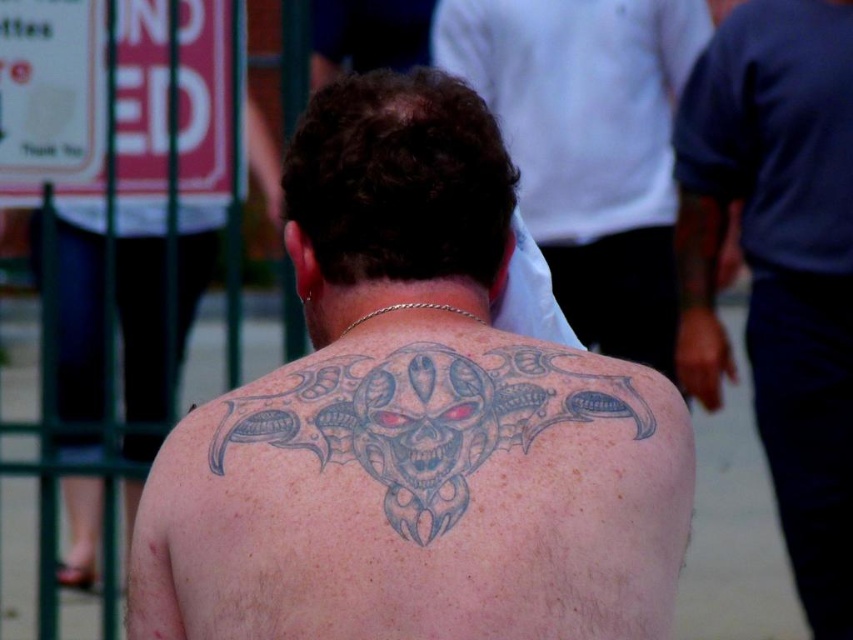
You are standing in a crowded park and see a person with a tattoo on their back. You want to take a photo of the tattoo without getting too close. The tattoo is located at point (370, 148). If your camera has a zoom lens that can focus on objects up to 2.5 meters away, can you capture the tattoo clearly from your current position?

The point (370, 148) is 2.30 meters away from the camera. Since the camera can focus up to 2.5 meters, you can capture the tattoo clearly from your current position because the distance is within the camera lens range.

You are a photographer trying to capture the tattoo on the gray tattooed skin at center and the dark blue shirt at right. Since you want to focus on the tattoo, which object should you zoom in on more and why?

You should zoom in more on the gray tattooed skin at center because its width surpasses that of the dark blue shirt at right, making it larger and easier to focus on the intricate details of the tattoo.

You are a photographer standing at a distance. You want to take a closeup photo of the gray tattooed skin at center. Your camera has a minimum focusing distance of 1.5 meters. Can you take the photo without moving closer?

The gray tattooed skin at center and viewer are 1.87 meters apart. Since the minimum focusing distance is 1.5 meters, you can take the photo without moving closer because the distance is within the camera capability.